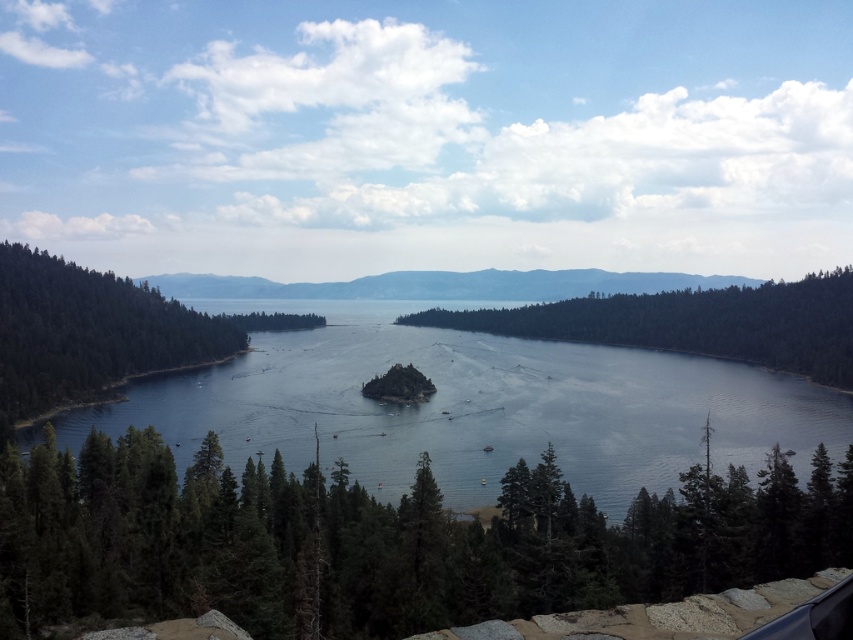
Question: Is green matte tree at lower center bigger than green matte tree at left?

Choices:
 (A) yes
 (B) no

Answer: (B)

Question: Which point appears closest to the camera in this image?

Choices:
 (A) (13, 401)
 (B) (91, 538)
 (C) (585, 486)
 (D) (173, 289)

Answer: (B)

Question: Observing the image, what is the correct spatial positioning of green matte tree at left in reference to gray/rocky mountain at center?

Choices:
 (A) left
 (B) right

Answer: (A)

Question: Which object is positioned farthest from the green matte tree at left?

Choices:
 (A) green matte tree at lower center
 (B) gray/rocky mountain at center
 (C) green textured island at center

Answer: (B)

Question: Where is clear blue water at center located in relation to gray/rocky mountain at center in the image?

Choices:
 (A) above
 (B) below

Answer: (B)

Question: Which of the following is the farthest from the observer?

Choices:
 (A) (608, 440)
 (B) (387, 580)
 (C) (265, 278)
 (D) (138, 368)

Answer: (C)